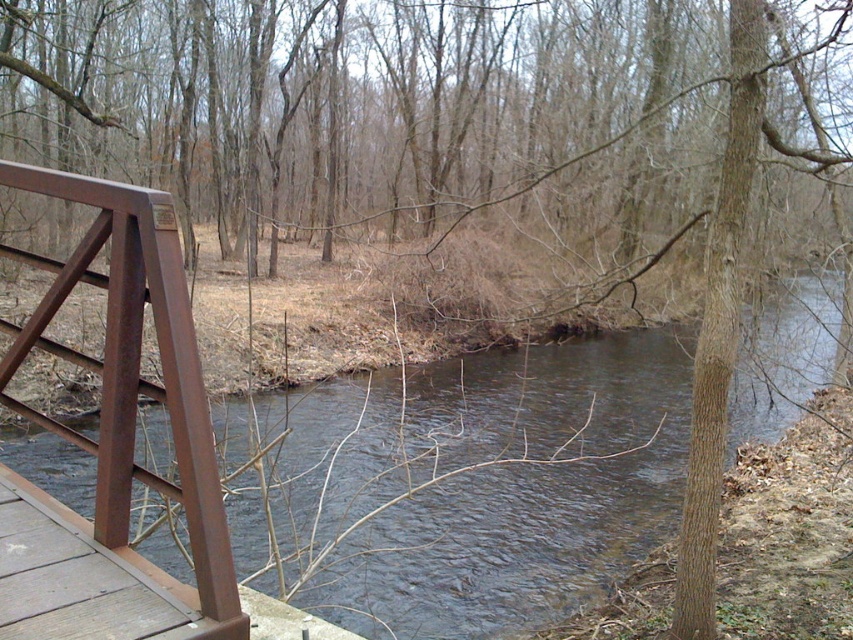
Between dark brown water at left and brown metal/rail at left, which one has more height?

With more height is dark brown water at left.

Who is positioned more to the left, dark brown water at left or brown metal/rail at left?

From the viewer's perspective, brown metal/rail at left appears more on the left side.

Between point (645, 531) and point (61, 637), which one is positioned in front?

Point (61, 637) is in front.

Where is `dark brown water at left`? dark brown water at left is located at coordinates (519, 490).